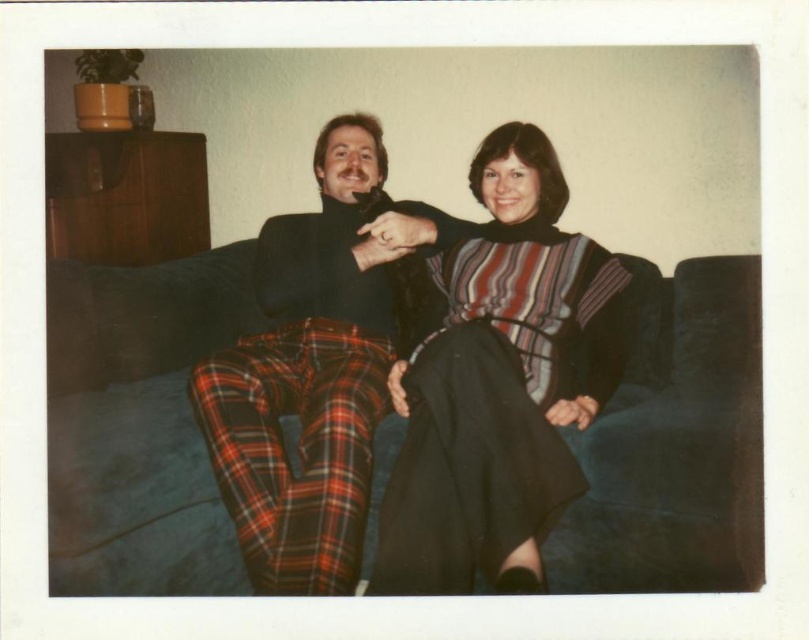
Question: Estimate the real-world distances between objects in this image. Which object is closer to the velvet blue couch at center?

Choices:
 (A) plaid wool pants at center
 (B) striped knit sweater at center

Answer: (A)

Question: Which is nearer to the velvet blue couch at center?

Choices:
 (A) plaid wool pants at center
 (B) striped knit sweater at center

Answer: (A)

Question: Is striped knit sweater at center above plaid wool pants at center?

Choices:
 (A) no
 (B) yes

Answer: (A)

Question: Which of the following is the closest to the observer?

Choices:
 (A) click(314, 464)
 (B) click(541, 211)
 (C) click(188, 449)

Answer: (A)

Question: Can you confirm if striped knit sweater at center is wider than plaid wool pants at center?

Choices:
 (A) no
 (B) yes

Answer: (B)

Question: Can you confirm if velvet blue couch at center is positioned below striped knit sweater at center?

Choices:
 (A) no
 (B) yes

Answer: (A)